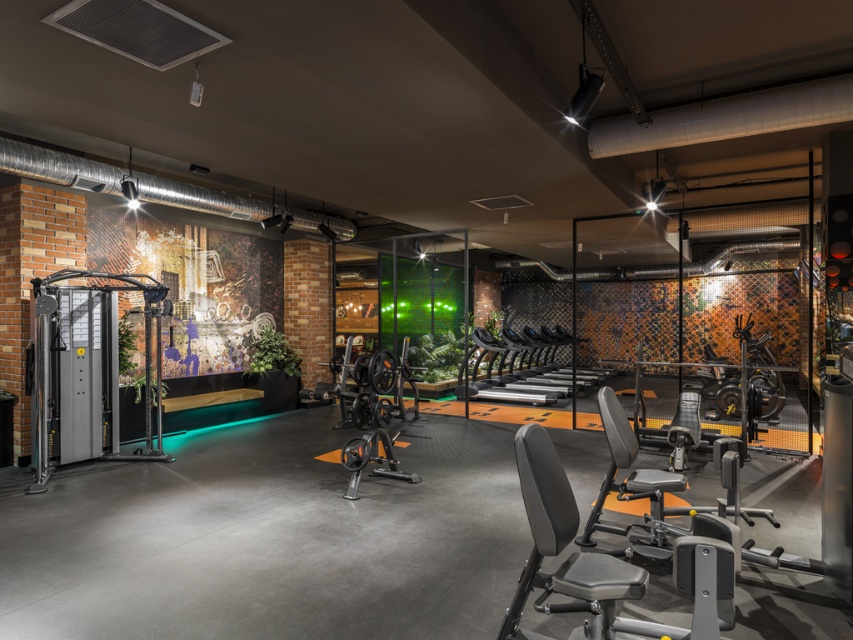
You are a gym member who wants to use both the silver metallic weight machine at left and the black textured weight bench at center. Since you can only move to one piece of equipment first, which one should you choose to reach first if you want to avoid climbing over anything?

The black textured weight bench at center should be chosen first because the silver metallic weight machine at left is located above it, meaning you would need to go around or under the weight machine if you start with the bench.

You are a fitness instructor preparing to set up a circuit training area in the gym. You need to place a 3.5 meter long exercise mat between the silver metallic weight machine at left and the black textured weight bench at center. Is there enough space between them to fit the mat?

The distance between the silver metallic weight machine at left and the black textured weight bench at center is 2.78 meters. Since the exercise mat is 3.5 meters long, which is longer than the available space, it won,t fit between them.